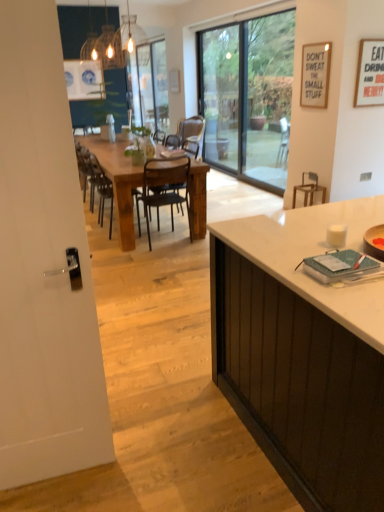
Question: Is wooden chair at center, the 3th chair positioned from the right, wider or thinner than metallic black chair at center, the second chair viewed from the left?

Choices:
 (A) thin
 (B) wide

Answer: (A)

Question: From the image's perspective, is wooden chair at center, acting as the 1th chair starting from the left, located above or below metallic black chair at center, the second chair viewed from the left?

Choices:
 (A) above
 (B) below

Answer: (A)

Question: Which is farther from the transparent glass screen door at center, which ranks as the 1th screen door in top-to-bottom order?

Choices:
 (A) wooden chair at center, acting as the 1th chair starting from the left
 (B) white glossy door at left, placed as the 1th screen door when sorted from front to back
 (C) black metal chair at center, the 1th chair in the right-to-left sequence
 (D) wooden armchair at right
 (E) rustic wood table at center

Answer: (B)

Question: Considering the real-world distances, which object is closest to the white matte cabinet at right?

Choices:
 (A) wooden chair at center, the 3th chair positioned from the right
 (B) rustic wood table at center
 (C) wooden armchair at right
 (D) black metal chair at center, the 1th chair in the right-to-left sequence
 (E) transparent glass screen door at center, the 2th screen door viewed from the front

Answer: (D)